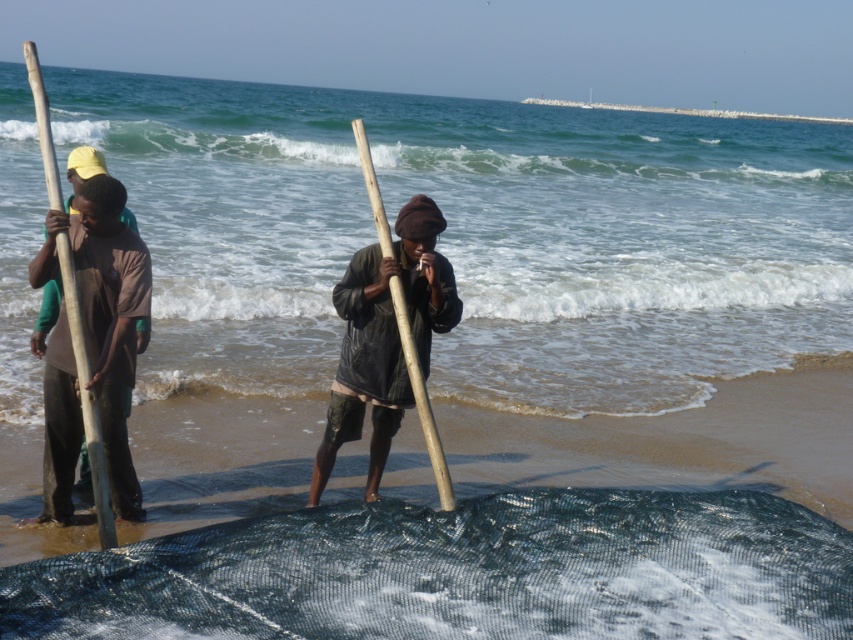
You are a swimmer who wants to dive into the water. You see the clear blue water at center and the wooden paddle at left. Which one is higher from the ground?

The clear blue water at center is higher than the wooden paddle at left according to the description.

You are standing on the beach and see two points marked on the sand. The first point is at coordinates point (39, 586) and the second is at point (91, 484). If you are facing the ocean, which point is closer to you?

Point (39, 586) is in front of point (91, 484), so if you are facing the ocean, point (39, 586) is closer to you.